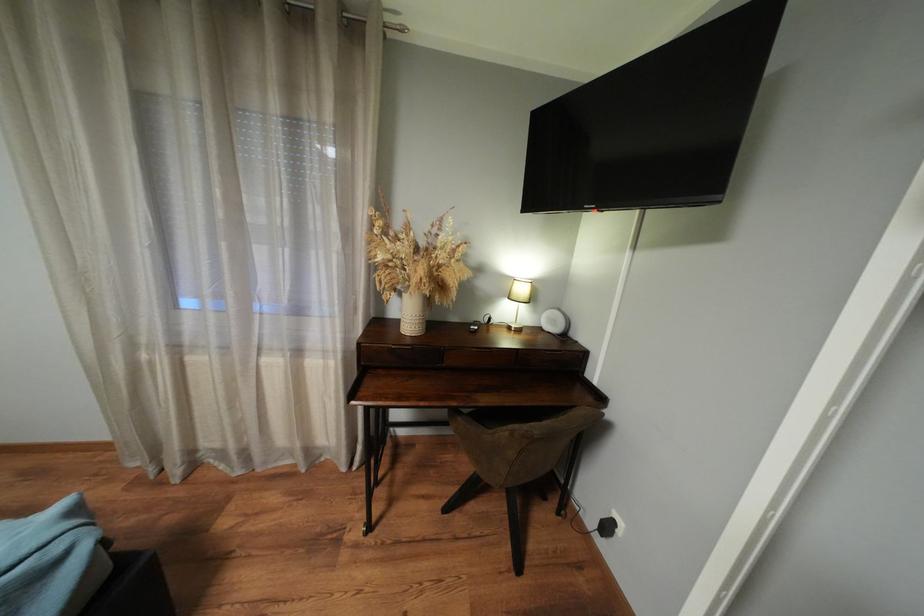
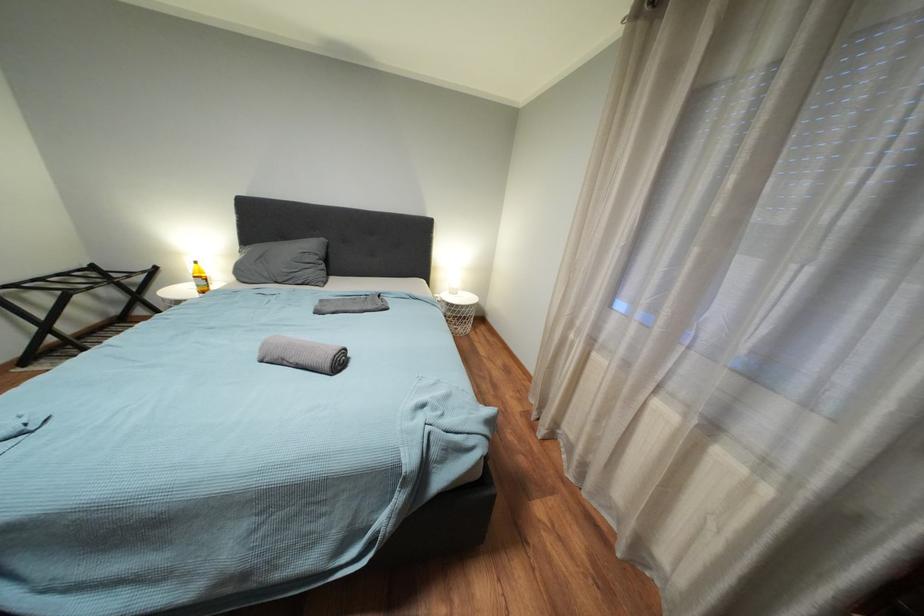
Question: Based on the continuous images, in which direction is the camera rotating? Reply with the corresponding letter.

Choices:
 (A) Left
 (B) Right
 (C) Up
 (D) Down

Answer: (A)